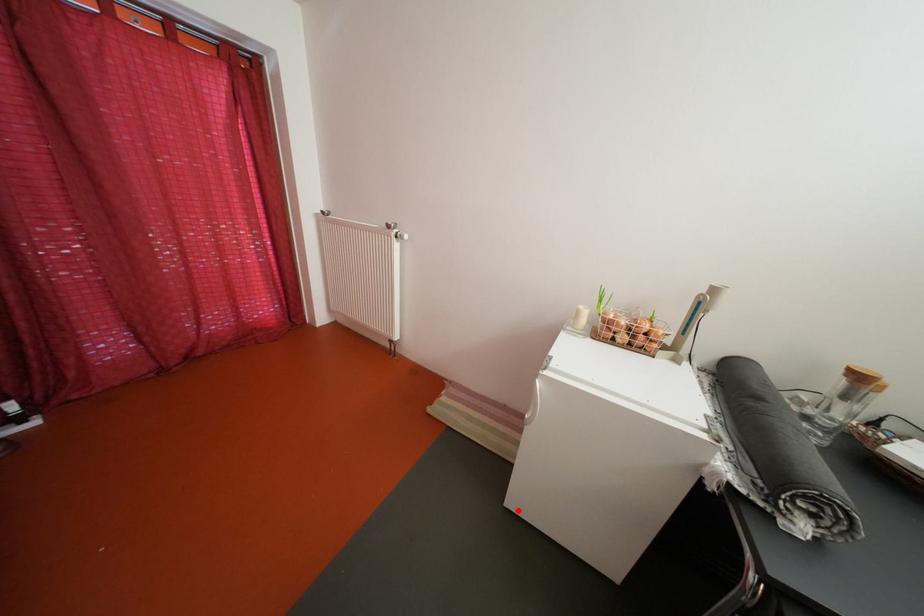
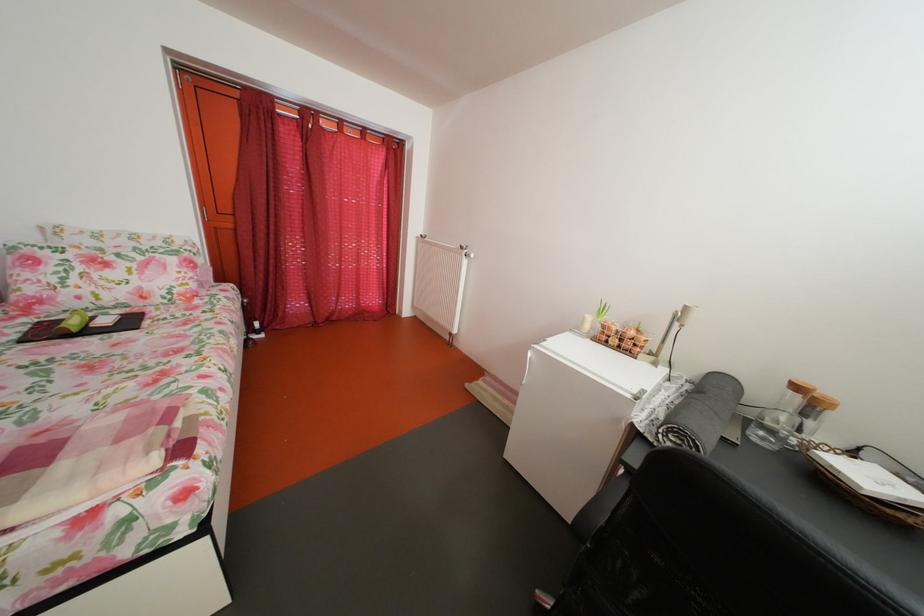
Find the pixel in the second image that matches the highlighted location in the first image.

(517, 463)